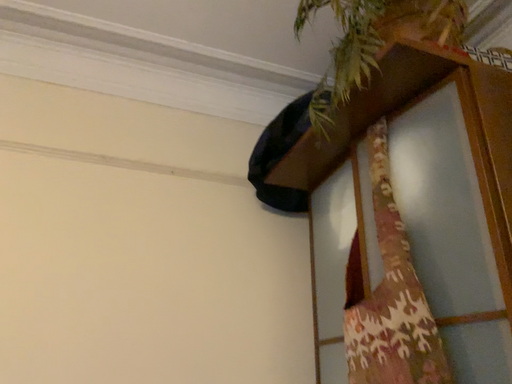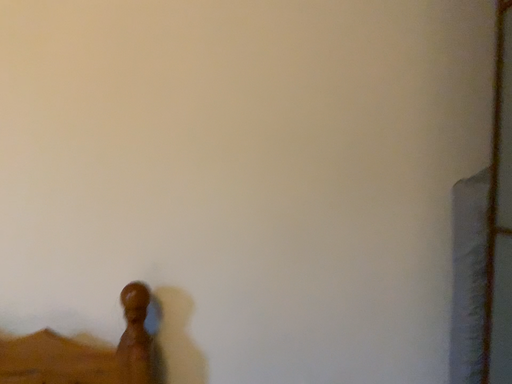
Question: Which way did the camera rotate in the video?

Choices:
 (A) rotated left
 (B) rotated right

Answer: (A)